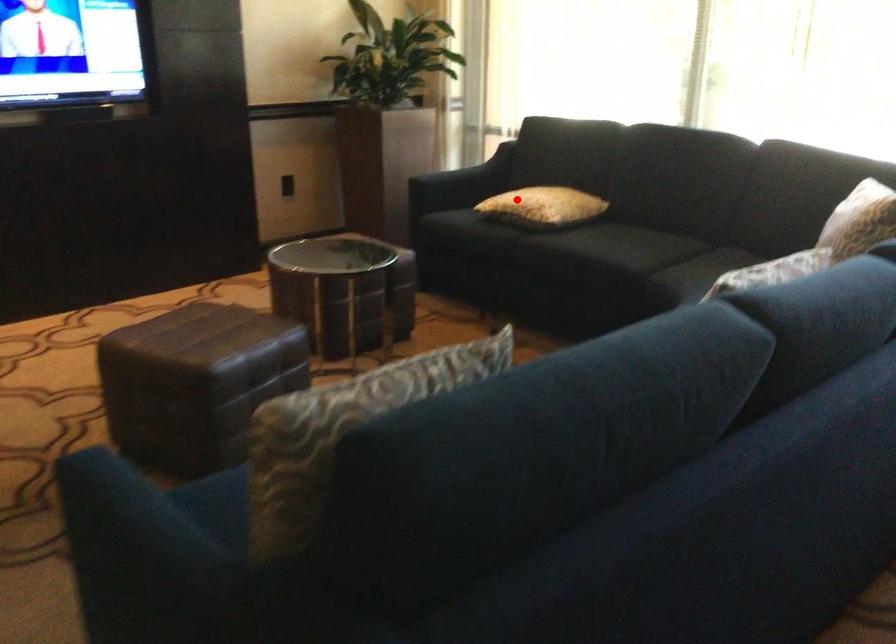
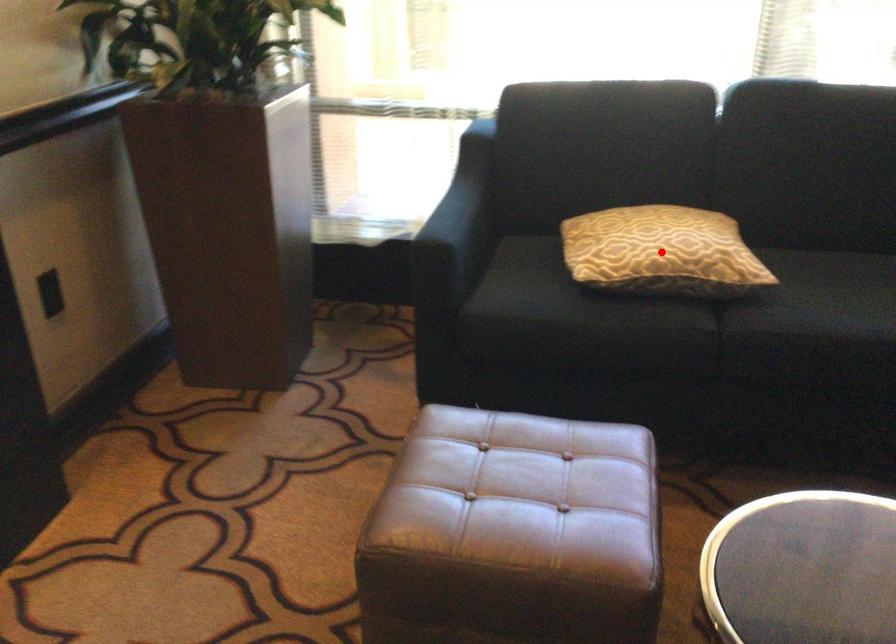
I am providing you with two images of the same scene from different viewpoints. A red point is marked on the first image and another point is marked on the second image. Do the highlighted points in image1 and image2 indicate the same real-world spot?

Yes